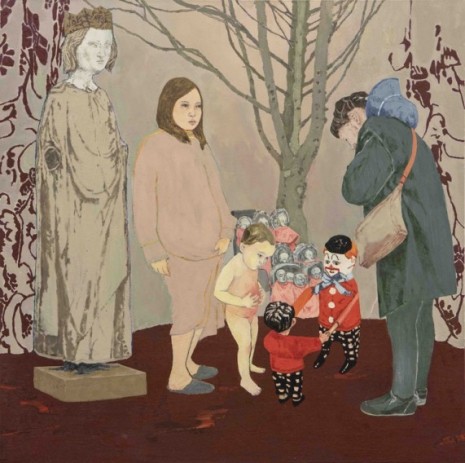
Where is `stand`? stand is located at coordinates (116, 384).